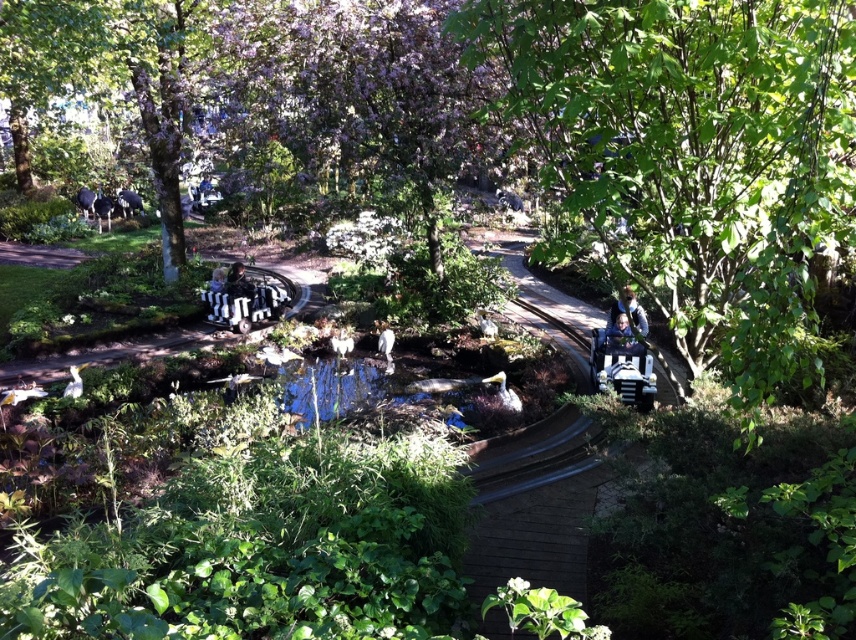
Question: Observing the image, what is the correct spatial positioning of blue denim jacket at upper right in reference to smooth black car at center?

Choices:
 (A) below
 (B) above

Answer: (A)

Question: Among these objects, which one is farthest from the camera?

Choices:
 (A) green leafy tree at center
 (B) smooth black car at center

Answer: (B)

Question: Among these objects, which one is farthest from the camera?

Choices:
 (A) smooth black car at center
 (B) green leafy tree at center
 (C) blue denim jacket at upper right
 (D) blue fabric jacket at center

Answer: (A)

Question: Among these objects, which one is nearest to the camera?

Choices:
 (A) smooth black car at center
 (B) blue denim jacket at upper right
 (C) blue fabric jacket at center

Answer: (B)

Question: Is green leafy tree at center bigger than blue fabric jacket at center?

Choices:
 (A) no
 (B) yes

Answer: (B)

Question: Is green leafy tree at center in front of blue denim jacket at upper right?

Choices:
 (A) yes
 (B) no

Answer: (A)